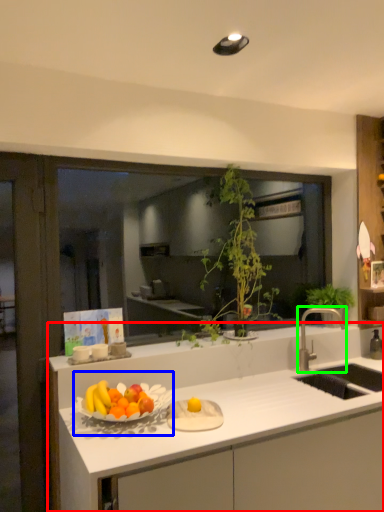
Question: Which object is positioned closest to countertop (highlighted by a red box)? Select from fruit dish (highlighted by a blue box) and tap (highlighted by a green box).

Choices:
 (A) fruit dish
 (B) tap

Answer: (A)